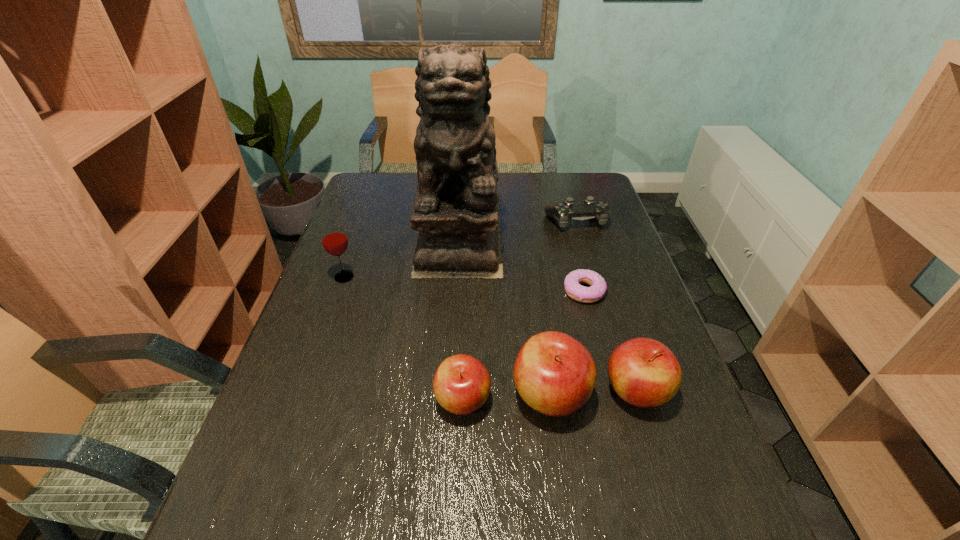
At what (x,y) coordinates should I click in order to perform the action: click on unoccupied area between the rightmost apple and the sixth tallest object. Please return your answer as a coordinate pair (x, y). The image size is (960, 540). Looking at the image, I should click on (606, 306).

Image resolution: width=960 pixels, height=540 pixels. I want to click on blank region between the second shortest apple and the glass, so click(491, 334).

In order to click on vacant space that is in between the control and the rightmost apple in this screenshot , I will do `click(606, 306)`.

Find the location of a particular element. Image resolution: width=960 pixels, height=540 pixels. free spot between the tallest object and the shortest object is located at coordinates (521, 264).

At what (x,y) coordinates should I click in order to perform the action: click on unoccupied area between the second shortest apple and the leftmost object. Please return your answer as a coordinate pair (x, y). Image resolution: width=960 pixels, height=540 pixels. Looking at the image, I should click on (491, 334).

At what (x,y) coordinates should I click in order to perform the action: click on object that is the fifth closest to the second shortest apple. Please return your answer as a coordinate pair (x, y). The width and height of the screenshot is (960, 540). Looking at the image, I should click on (563, 212).

You are a GUI agent. You are given a task and a screenshot of the screen. Output one action in this format:
    pyautogui.click(x=<x>, y=<y>)
    Task: Click on the object that ranks as the second closest to the tallest object
    This screenshot has width=960, height=540.
    Given the screenshot: What is the action you would take?
    pyautogui.click(x=334, y=240)

Select which apple appears as the closest to the second shortest object. Please provide its 2D coordinates. Your answer should be formatted as a tuple, i.e. [(x, y)], where the tuple contains the x and y coordinates of a point satisfying the conditions above.

[(554, 373)]

The height and width of the screenshot is (540, 960). Find the location of `the closest apple to the shortest object`. the closest apple to the shortest object is located at coordinates (554, 373).

Locate an element on the screen. The width and height of the screenshot is (960, 540). free space that satisfies the following two spatial constraints: 1. on the back side of the control; 2. on the left side of the fifth tallest object is located at coordinates coord(468,221).